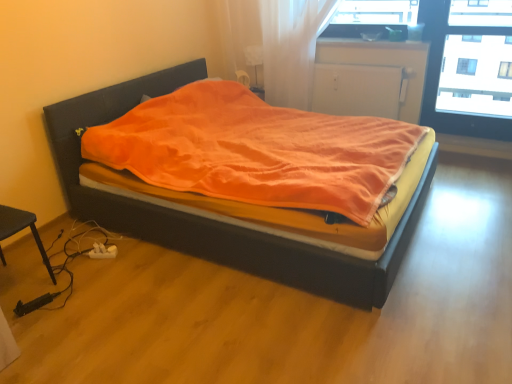
Question: Choose the correct answer: Is white matte radiator at upper center inside transparent glass window at upper right or outside it?

Choices:
 (A) outside
 (B) inside

Answer: (A)

Question: Is white matte radiator at upper center wider or thinner than transparent glass window at upper right?

Choices:
 (A) wide
 (B) thin

Answer: (B)

Question: Which is nearer to the white matte radiator at upper center?

Choices:
 (A) smooth wood window sill at right
 (B) transparent glass window at upper right
 (C) velvet orange blanket at center

Answer: (A)

Question: Which is farther from the smooth wood window sill at right?

Choices:
 (A) transparent glass window at upper right
 (B) white matte radiator at upper center
 (C) velvet orange blanket at center

Answer: (C)